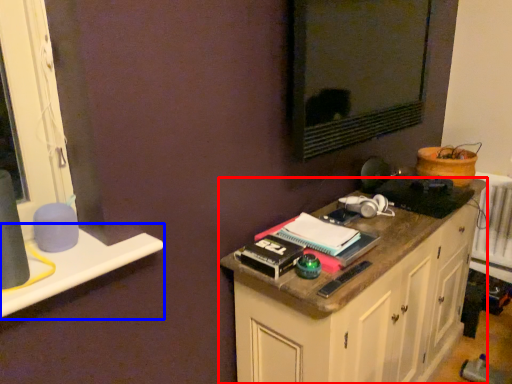
Question: Which object appears closest to the camera in this image, cabinetry (highlighted by a red box) or window sill (highlighted by a blue box)?

Choices:
 (A) cabinetry
 (B) window sill

Answer: (B)